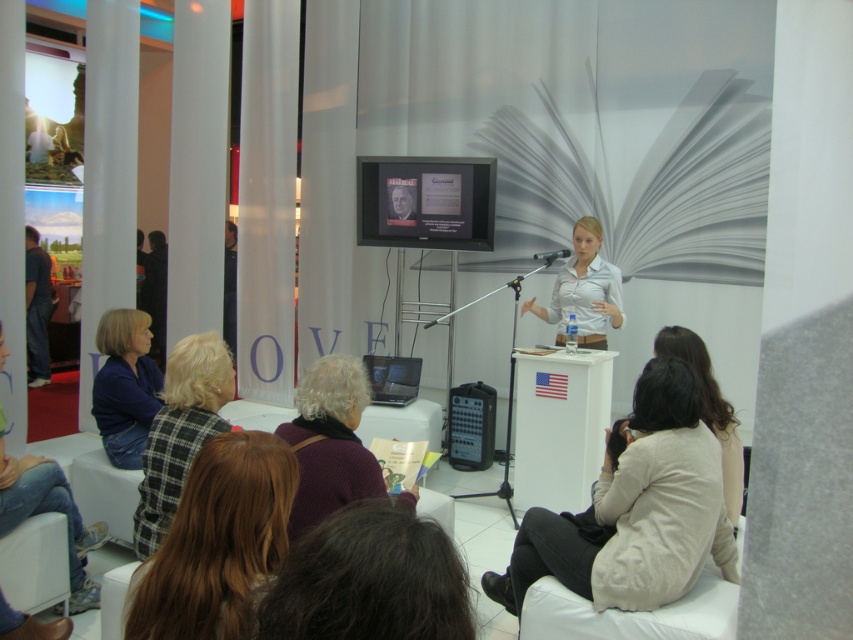
Can you confirm if plaid fabric jacket at lower left is positioned below light beige sweater at lower right?

Yes.

Measure the distance between point (183, 385) and camera.

8.87 feet

The height and width of the screenshot is (640, 853). Find the location of `plaid fabric jacket at lower left`. plaid fabric jacket at lower left is located at coordinates (180, 432).

Where is `plaid fabric jacket at lower left`? Image resolution: width=853 pixels, height=640 pixels. plaid fabric jacket at lower left is located at coordinates (180, 432).

Which is more to the right, blue fabric jacket at lower left or dark fabric jacket at left?

blue fabric jacket at lower left

Where is `blue fabric jacket at lower left`? blue fabric jacket at lower left is located at coordinates (125, 385).

The height and width of the screenshot is (640, 853). I want to click on white matte jacket at lower center, so click(635, 508).

Between white matte jacket at lower center and blue fabric jacket at lower left, which one appears on the left side from the viewer's perspective?

Positioned to the left is blue fabric jacket at lower left.

Where is `white matte jacket at lower center`? The image size is (853, 640). white matte jacket at lower center is located at coordinates (635, 508).